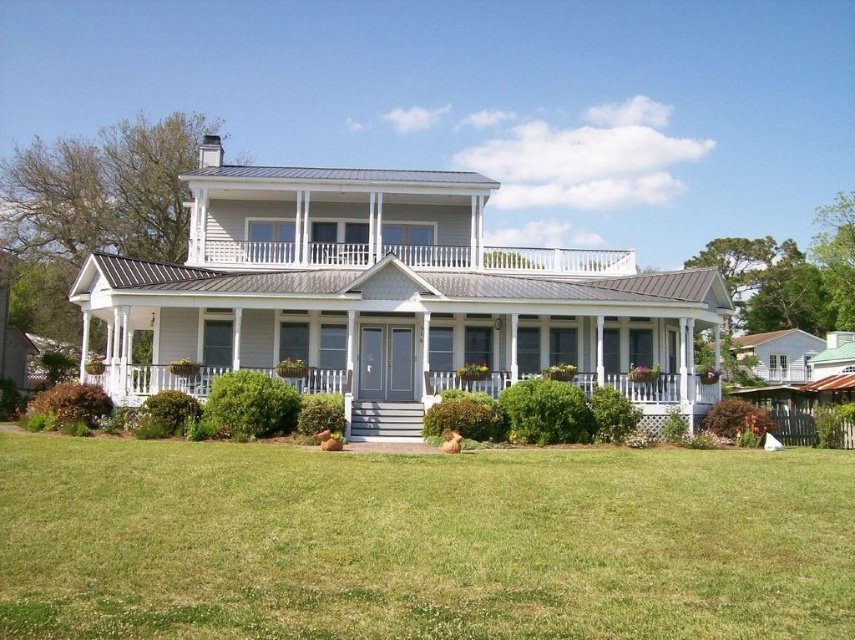
You are standing in front of the two story house and want to walk from the green grass at center to the white painted wood porch at upper center. Which direction should you move to reach the porch?

The white painted wood porch at upper center is higher than the green grass at center, so you should move upward to reach the porch.

In the scene shown: You are standing at the front door of the house. Looking around, you notice a point marked at coordinates [420,541]. What is located at that point?

The point at coordinates [420,541] corresponds to green grass at center.

You are standing in front of the house and want to walk to the white painted wood porch at upper center. Which direction should you move to reach it from the green grass at center?

The green grass at center is closer to the viewer than the white painted wood porch at upper center, so you should move forward towards the house to reach the white painted wood porch at upper center.